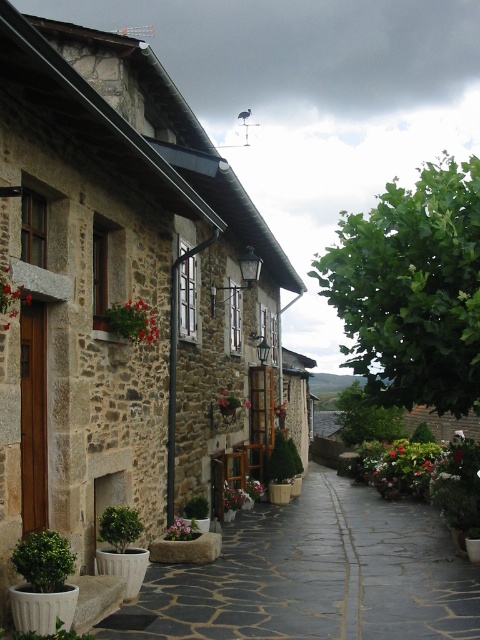
Question: Does smooth stone alley at center appear on the left side of green matte flower at center?

Choices:
 (A) yes
 (B) no

Answer: (B)

Question: From the image, what is the correct spatial relationship of green leafy bush at lower left in relation to pink matte flower at center?

Choices:
 (A) left
 (B) right

Answer: (A)

Question: Which object is farther from the camera taking this photo?

Choices:
 (A) smooth stone alley at center
 (B) stone wall at left

Answer: (A)

Question: Can you confirm if stone wall at left is bigger than pink matte flower at center?

Choices:
 (A) no
 (B) yes

Answer: (B)

Question: Which point is closer to the camera?

Choices:
 (A) green matte potted plant at lower left
 (B) green matte flower at center
 (C) pink matte flower at center
 (D) green leafy plant at center

Answer: (A)

Question: Estimate the real-world distances between objects in this image. Which object is farther from the green matte potted plant at lower left?

Choices:
 (A) red matte flower at upper left
 (B) stone wall at left
 (C) green leafy bush at lower left

Answer: (B)